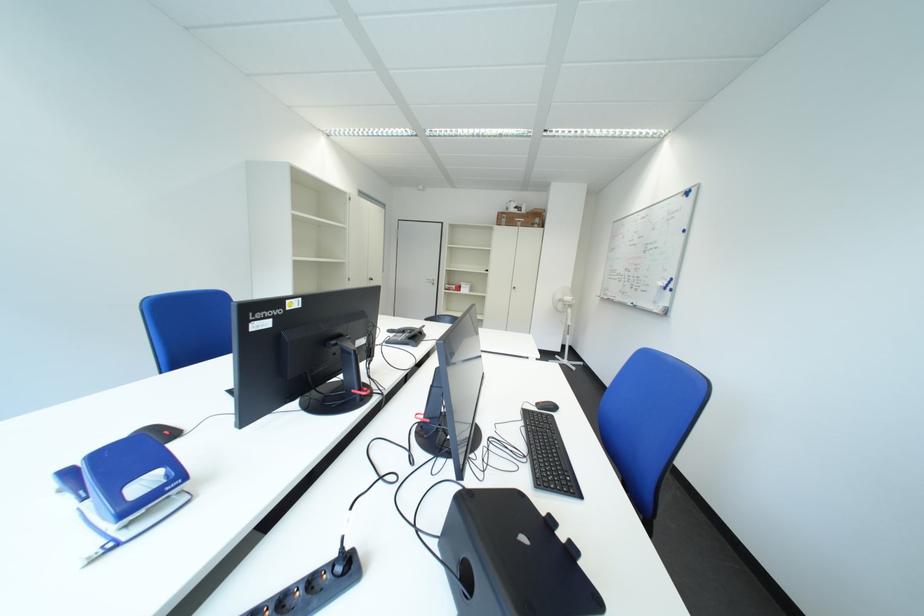
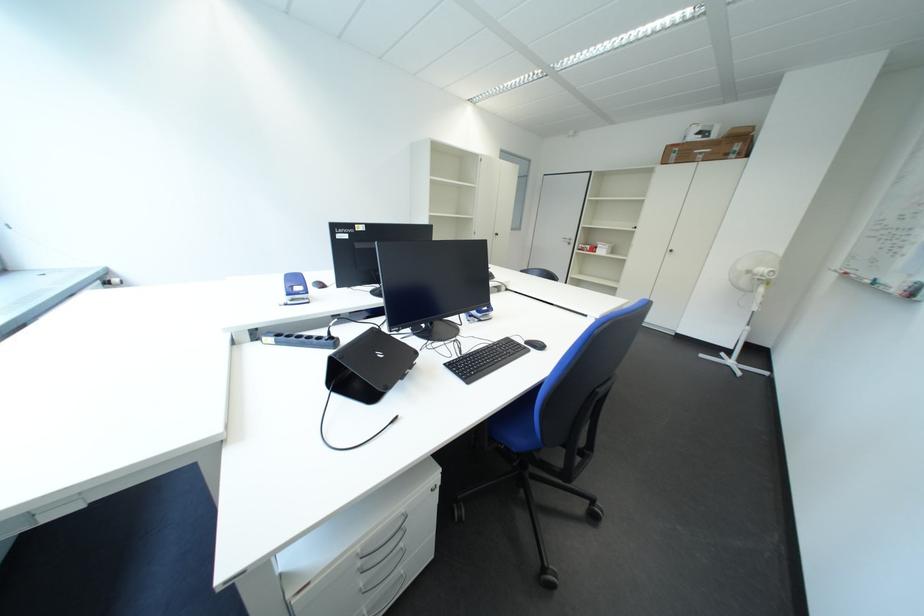
Locate, in the second image, the point that corresponds to (x=553, y=416) in the first image.

(531, 347)